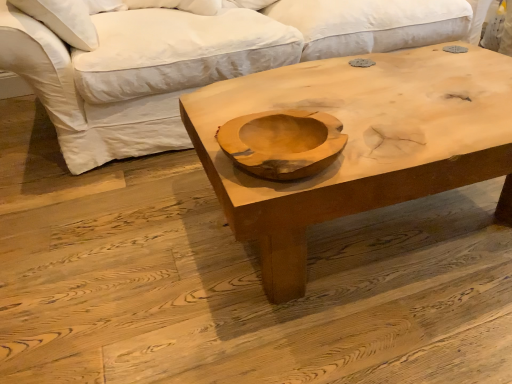
Where is `vacant space underneath natural wood coffee table at center (from a real-world perspective)`? This screenshot has width=512, height=384. vacant space underneath natural wood coffee table at center (from a real-world perspective) is located at coordinates (394, 234).